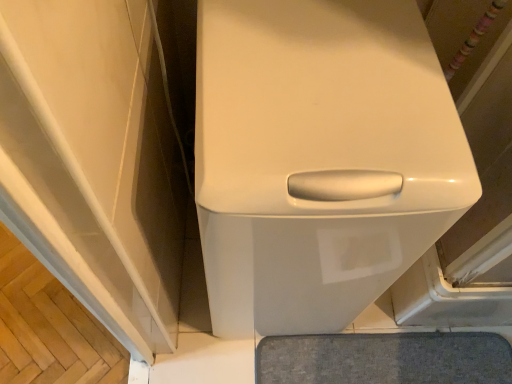
Where is `white glossy toilet at center`? white glossy toilet at center is located at coordinates (318, 157).

Image resolution: width=512 pixels, height=384 pixels. What do you see at coordinates (318, 157) in the screenshot?
I see `white glossy toilet at center` at bounding box center [318, 157].

I want to click on white glossy toilet at center, so click(x=318, y=157).